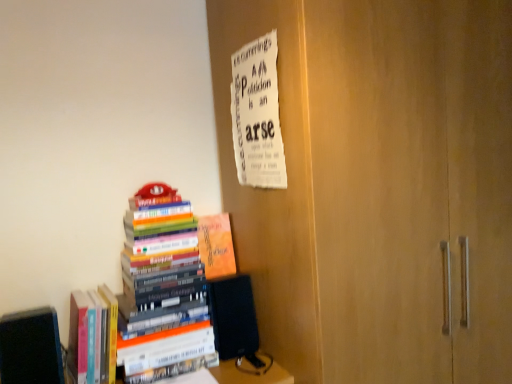
Question: Does point (183, 317) appear closer or farther from the camera than point (268, 71)?

Choices:
 (A) closer
 (B) farther

Answer: (B)

Question: Considering the positions of hardcover books at left, which appears as the second book when viewed from the right, and white paper at upper center in the image, is hardcover books at left, which appears as the second book when viewed from the right, taller or shorter than white paper at upper center?

Choices:
 (A) tall
 (B) short

Answer: (A)

Question: Estimate the real-world distances between objects in this image. Which object is closer to the white paper at upper center?

Choices:
 (A) hardcover books at left, which appears as the 3th book when viewed from the right
 (B) black matte book at lower left, marked as the first book in a left-to-right arrangement
 (C) orange matte book at center, which appears as the 1th book when viewed from the right
 (D) hardcover books at left, which is counted as the third book, starting from the left

Answer: (C)

Question: Estimate the real-world distances between objects in this image. Which object is closer to the orange matte book at center, which appears as the 1th book when viewed from the right?

Choices:
 (A) hardcover books at left, which appears as the second book when viewed from the right
 (B) hardcover books at left, which appears as the 3th book when viewed from the right
 (C) black matte book at lower left, the 4th book viewed from the right
 (D) white paper at upper center

Answer: (A)